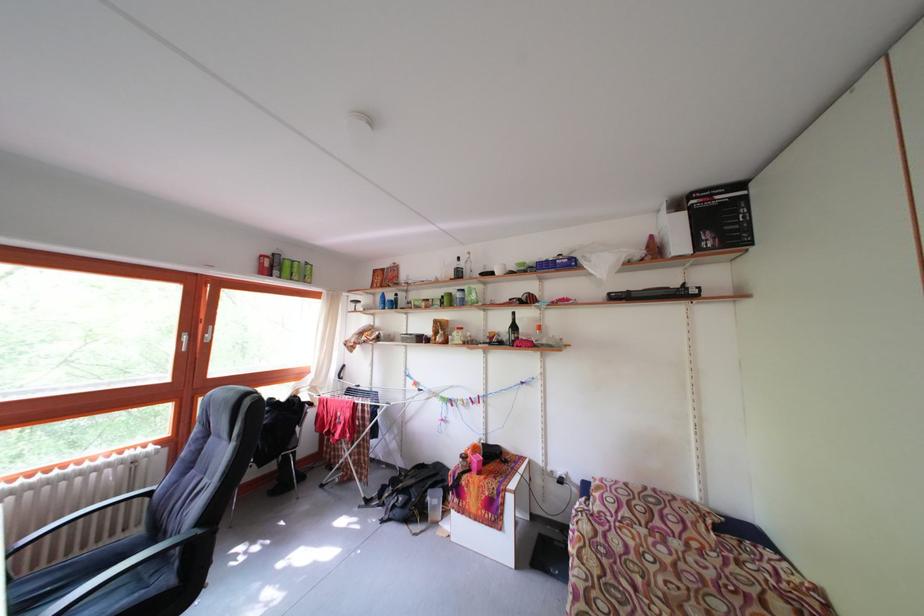
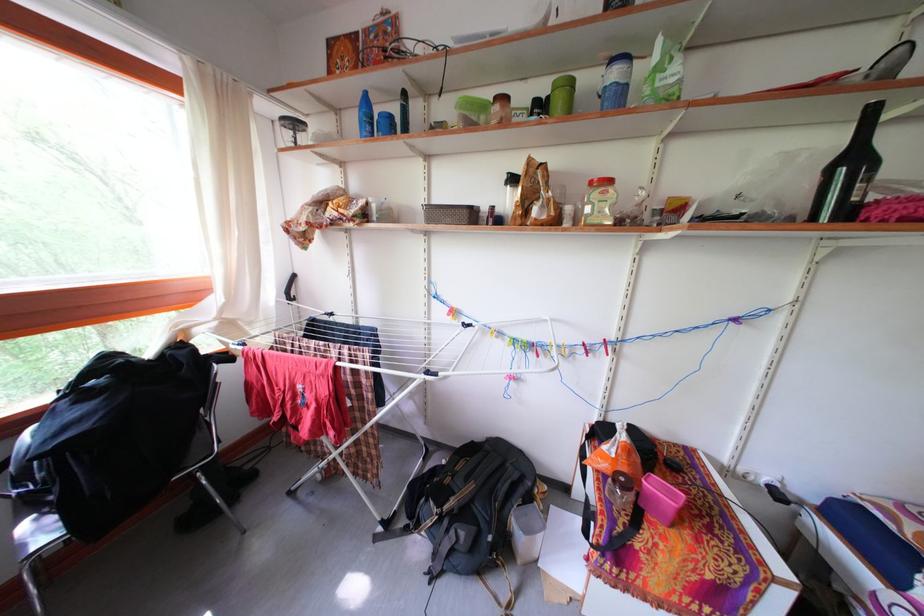
Find the pixel in the second image that matches pixel 387 305 in the first image.

(360, 126)